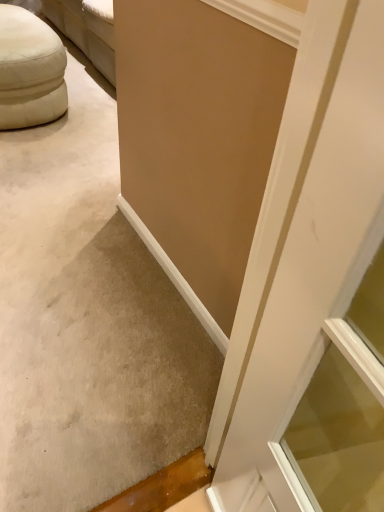
Question: Can you confirm if white fabric ottoman at upper left is wider than beige matte wall at upper center?

Choices:
 (A) yes
 (B) no

Answer: (A)

Question: Is white fabric ottoman at upper left smaller than beige matte wall at upper center?

Choices:
 (A) no
 (B) yes

Answer: (A)

Question: Is white fabric ottoman at upper left further to camera compared to beige matte wall at upper center?

Choices:
 (A) yes
 (B) no

Answer: (A)

Question: Is white fabric ottoman at upper left next to beige matte wall at upper center and touching it?

Choices:
 (A) yes
 (B) no

Answer: (B)

Question: From a real-world perspective, is white fabric ottoman at upper left positioned under beige matte wall at upper center based on gravity?

Choices:
 (A) yes
 (B) no

Answer: (A)

Question: Considering the relative sizes of white fabric ottoman at upper left and beige matte wall at upper center in the image provided, is white fabric ottoman at upper left shorter than beige matte wall at upper center?

Choices:
 (A) yes
 (B) no

Answer: (A)

Question: From the image's perspective, does beige matte wall at upper center appear lower than white fabric ottoman at upper left?

Choices:
 (A) yes
 (B) no

Answer: (A)

Question: Is beige matte wall at upper center facing away from white fabric ottoman at upper left?

Choices:
 (A) yes
 (B) no

Answer: (B)

Question: From a real-world perspective, is beige matte wall at upper center positioned over white fabric ottoman at upper left based on gravity?

Choices:
 (A) yes
 (B) no

Answer: (A)

Question: Does beige matte wall at upper center come behind white fabric ottoman at upper left?

Choices:
 (A) no
 (B) yes

Answer: (A)

Question: Is white fabric ottoman at upper left completely or partially inside beige matte wall at upper center?

Choices:
 (A) yes
 (B) no

Answer: (B)

Question: Does beige matte wall at upper center have a greater height compared to white fabric ottoman at upper left?

Choices:
 (A) yes
 (B) no

Answer: (A)

Question: Is white fabric ottoman at upper left inside the boundaries of beige matte wall at upper center, or outside?

Choices:
 (A) outside
 (B) inside

Answer: (A)